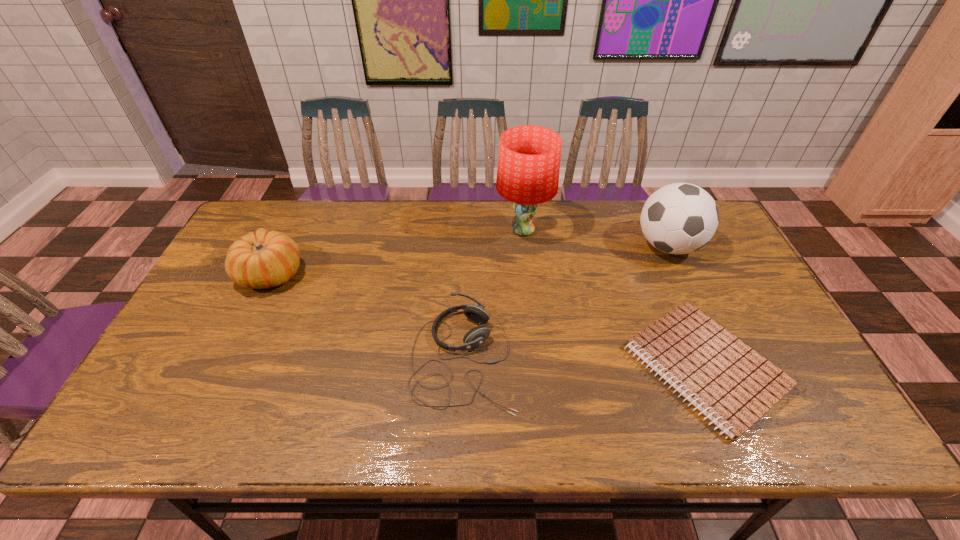
Where is `object located at the far right corner`? Image resolution: width=960 pixels, height=540 pixels. object located at the far right corner is located at coordinates (680, 218).

Where is `object that is at the near right corner`? object that is at the near right corner is located at coordinates (732, 385).

What are the coordinates of `vacant space at the far edge of the desktop` in the screenshot? It's located at (409, 215).

Image resolution: width=960 pixels, height=540 pixels. I want to click on free location at the near edge, so click(615, 419).

The width and height of the screenshot is (960, 540). In order to click on vacant space at the left edge of the desktop in this screenshot , I will do `click(228, 280)`.

In the image, there is a desktop. Where is `vacant region at the right edge`? This screenshot has width=960, height=540. vacant region at the right edge is located at coordinates (708, 269).

In the image, there is a desktop. At what (x,y) coordinates should I click in order to perform the action: click on vacant area at the far right corner. Please return your answer as a coordinate pair (x, y). This screenshot has width=960, height=540. Looking at the image, I should click on (719, 235).

Identify the location of vacant space in between the notebook and the headset. (583, 362).

Where is `free space between the tallest object and the gourd`? This screenshot has width=960, height=540. free space between the tallest object and the gourd is located at coordinates (397, 252).

Find the location of a particular element. This screenshot has width=960, height=540. vacant area that lies between the soccer ball and the leftmost object is located at coordinates (469, 260).